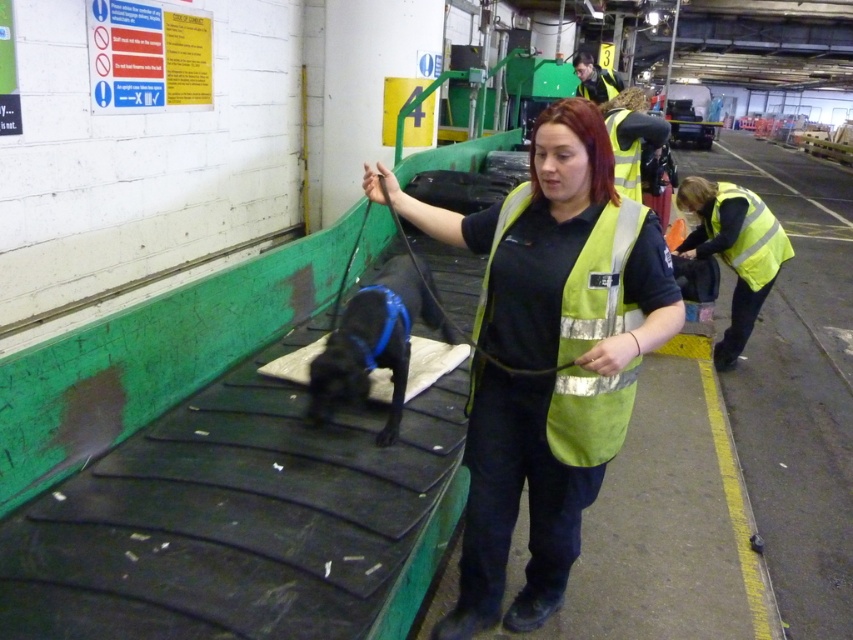
How much distance is there between reflective yellow vest at center and reflective yellow vest at upper center?

They are 6.22 meters apart.

Can you confirm if reflective yellow vest at center is taller than reflective yellow vest at upper center?

Yes, reflective yellow vest at center is taller than reflective yellow vest at upper center.

Which is in front, point (548, 428) or point (612, 90)?

Point (548, 428) is in front.

In order to click on reflective yellow vest at center in this screenshot , I will do `click(543, 360)`.

Is point (625, 273) positioned before point (553, 390)?

Yes, point (625, 273) is closer to viewer.

Can you confirm if reflective yellow vest at center is thinner than high visibility fabric safety vest at center?

No.

Who is more distant from viewer, (642,348) or (520,196)?

The point (520,196) is behind.

The width and height of the screenshot is (853, 640). What are the coordinates of `reflective yellow vest at center` in the screenshot? It's located at (543, 360).

Does yellow reflective safety vest at right lie behind reflective yellow vest at upper center?

No, it is not.

Can you confirm if yellow reflective safety vest at right is shorter than reflective yellow vest at upper center?

No, yellow reflective safety vest at right is not shorter than reflective yellow vest at upper center.

Is point (761, 237) behind point (585, 74)?

No, (761, 237) is in front of (585, 74).

Find the location of a particular element. The height and width of the screenshot is (640, 853). yellow reflective safety vest at right is located at coordinates (750, 237).